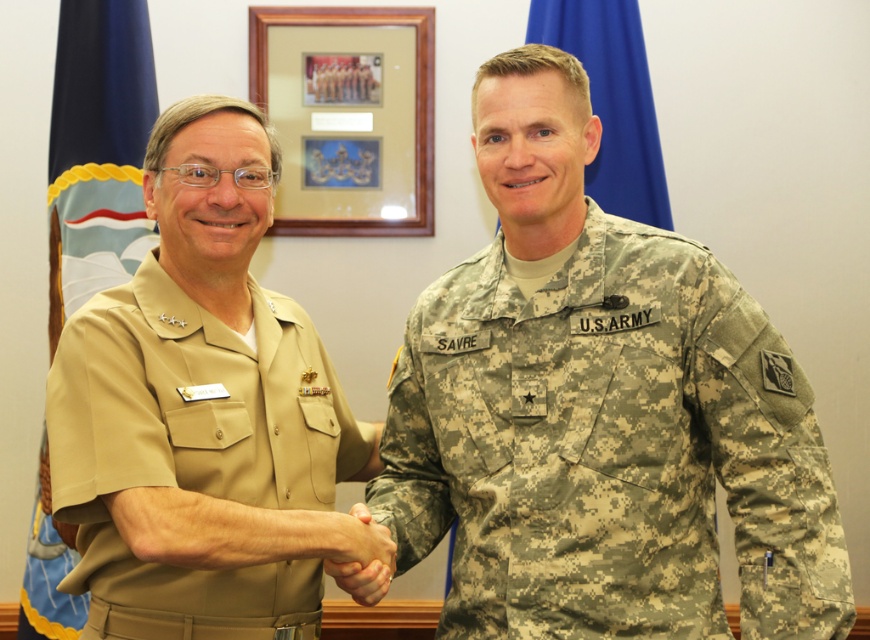
How far apart are tan fabric uniform at left and blue fabric flag at upper center?

tan fabric uniform at left is 1.25 meters away from blue fabric flag at upper center.

Does tan fabric uniform at left have a greater width compared to blue fabric flag at upper center?

Indeed, tan fabric uniform at left has a greater width compared to blue fabric flag at upper center.

The image size is (870, 640). Describe the element at coordinates (193, 451) in the screenshot. I see `tan fabric uniform at left` at that location.

At what (x,y) coordinates should I click in order to perform the action: click on tan fabric uniform at left. Please return your answer as a coordinate pair (x, y). Image resolution: width=870 pixels, height=640 pixels. Looking at the image, I should click on (193, 451).

Is blue fabric flag at left wider than blue fabric flag at upper center?

Incorrect, blue fabric flag at left's width does not surpass blue fabric flag at upper center's.

Is point (37, 579) positioned before point (590, 186)?

No, (37, 579) is behind (590, 186).

In order to click on blue fabric flag at left in this screenshot , I will do `click(97, 150)`.

Which is more to the left, camouflage fabric us army uniform at center or tan fabric uniform at left?

tan fabric uniform at left is more to the left.

Between point (500, 240) and point (145, 589), which one is positioned in front?

Positioned in front is point (145, 589).

The height and width of the screenshot is (640, 870). Identify the location of camouflage fabric us army uniform at center. (609, 449).